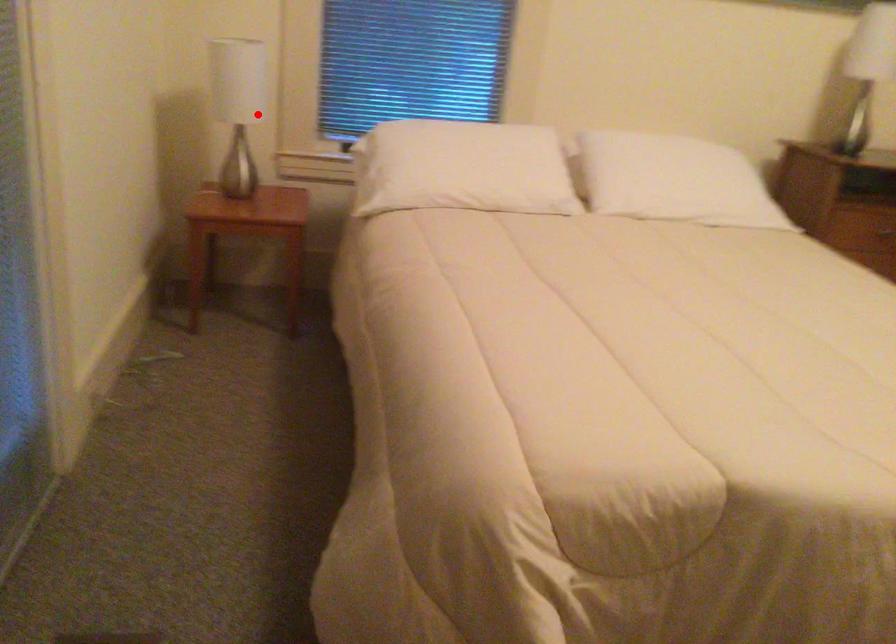
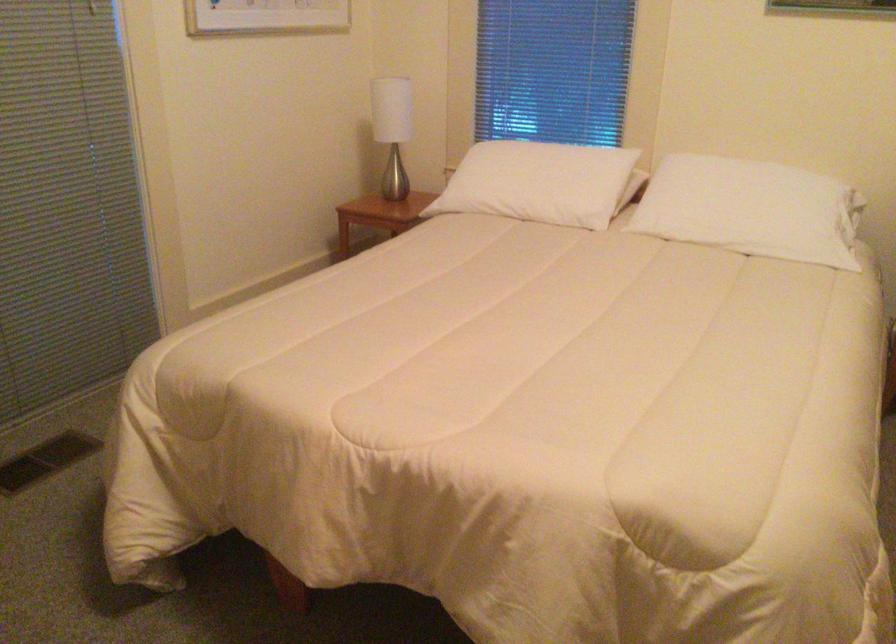
The point at the highlighted location is marked in the first image. Where is the corresponding point in the second image?

(392, 129)